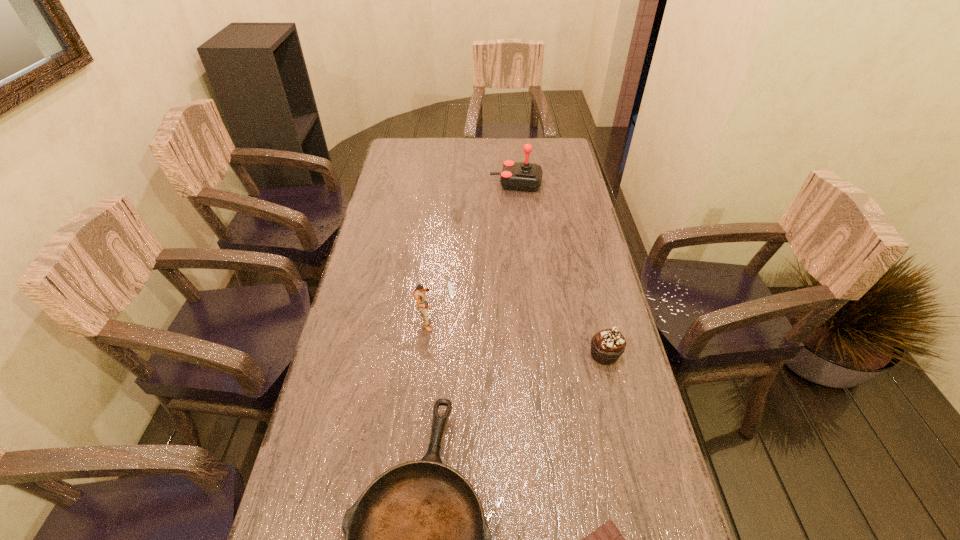
Locate an element on the screen. object that is the fourth nearest to the farthest object is located at coordinates (607, 539).

The height and width of the screenshot is (540, 960). What are the coordinates of `vacant space that satisfies the following two spatial constraints: 1. on the front side of the joystick; 2. on the front-facing side of the second farthest object` in the screenshot? It's located at (530, 319).